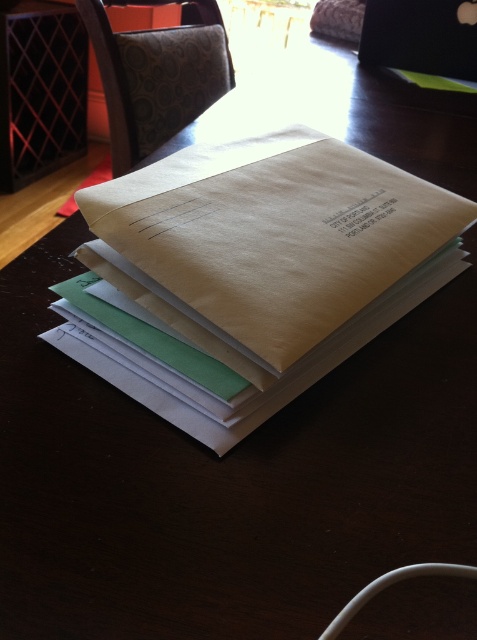
Question: Which point appears closest to the camera in this image?

Choices:
 (A) (475, 38)
 (B) (333, 288)

Answer: (B)

Question: Based on their relative distances, which object is farther from the matte paper envelope at center?

Choices:
 (A) black glossy laptop at upper right
 (B) brown paper book at center

Answer: (A)

Question: Can you confirm if matte paper envelope at center is positioned to the right of black glossy laptop at upper right?

Choices:
 (A) no
 (B) yes

Answer: (A)

Question: Which point is farther to the camera?

Choices:
 (A) (164, 173)
 (B) (441, 10)
 (C) (196, 406)

Answer: (B)

Question: Does brown paper book at center appear on the right side of black glossy laptop at upper right?

Choices:
 (A) no
 (B) yes

Answer: (A)

Question: Is the position of matte paper envelope at center more distant than that of black glossy laptop at upper right?

Choices:
 (A) no
 (B) yes

Answer: (A)